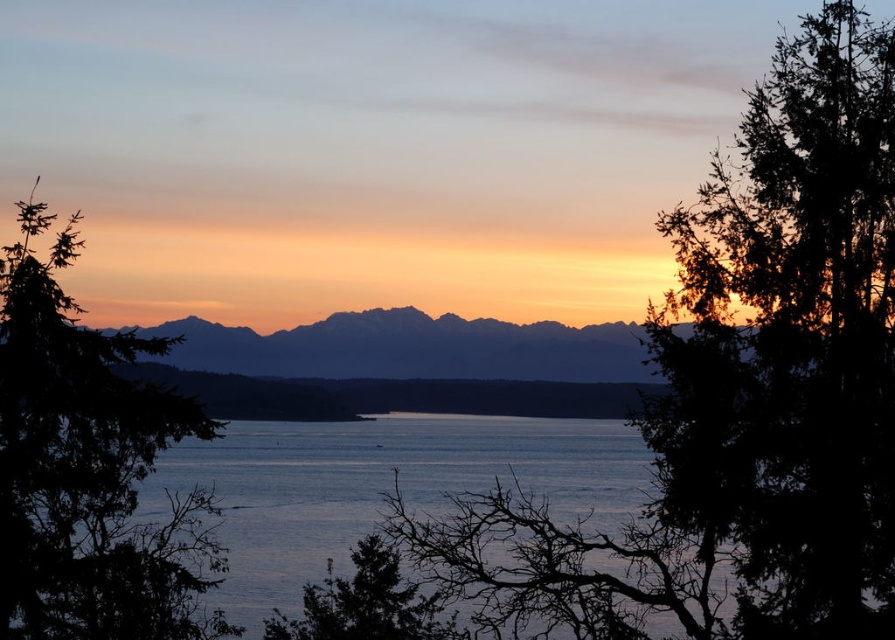
Is green leafy tree at right wider than blue water at center?

No, green leafy tree at right is not wider than blue water at center.

Between green leafy tree at right and blue water at center, which one appears on the right side from the viewer's perspective?

green leafy tree at right

Does point (874, 472) come farther from viewer compared to point (553, 448)?

No, it is in front of (553, 448).

Identify the location of green leafy tree at right. Image resolution: width=895 pixels, height=640 pixels. (746, 387).

Is green leafy tree at left above silhouetted rock formation at center?

Indeed, green leafy tree at left is positioned over silhouetted rock formation at center.

Is green leafy tree at left thinner than silhouetted rock formation at center?

Yes.

Between point (96, 579) and point (175, 321), which one is positioned in front?

Point (96, 579) is more forward.

I want to click on green leafy tree at left, so click(87, 467).

Is green leafy tree at left bigger than green matte tree at lower center?

Indeed, green leafy tree at left has a larger size compared to green matte tree at lower center.

Between green leafy tree at left and green matte tree at lower center, which one has more height?

With more height is green leafy tree at left.

This screenshot has width=895, height=640. In order to click on green leafy tree at left in this screenshot , I will do `click(87, 467)`.

This screenshot has width=895, height=640. I want to click on green leafy tree at left, so click(x=87, y=467).